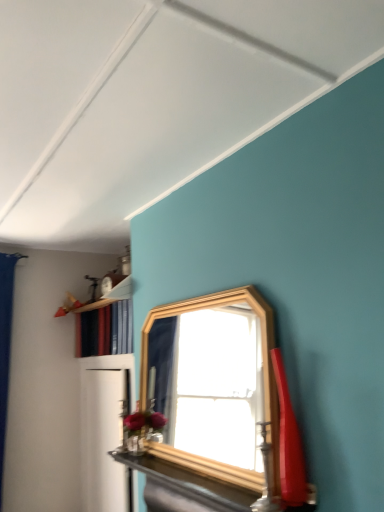
Image resolution: width=384 pixels, height=512 pixels. I want to click on wooden shelf at upper left, so click(x=105, y=330).

The height and width of the screenshot is (512, 384). What do you see at coordinates (105, 330) in the screenshot? I see `wooden shelf at upper left` at bounding box center [105, 330].

Find the location of a particular element. wooden shelf at upper left is located at coordinates (105, 330).